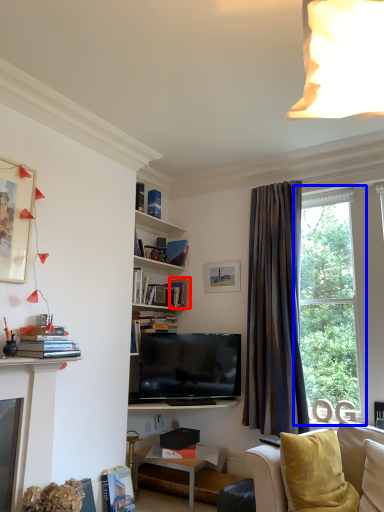
Question: Which of the following is the farthest to the observer, book (highlighted by a red box) or window (highlighted by a blue box)?

Choices:
 (A) book
 (B) window

Answer: (A)